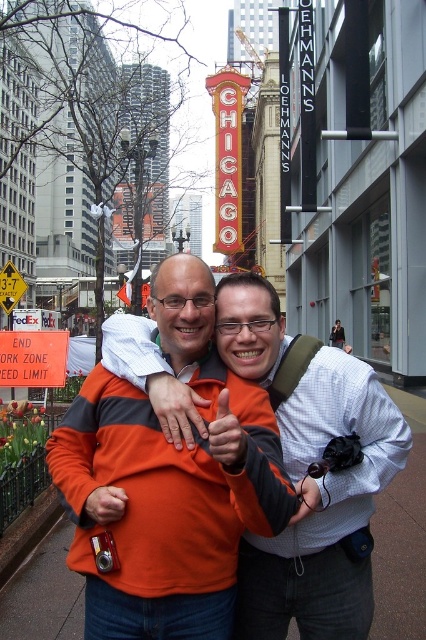
Question: Which object appears farthest from the camera in this image?

Choices:
 (A) yellowmaterial/texturestreet sign at left
 (B) orange plastic sign at lower left

Answer: (A)

Question: Does orange fleece jacket at center appear over yellowmaterial/texturestreet sign at left?

Choices:
 (A) yes
 (B) no

Answer: (B)

Question: Which point is closer to the camera?

Choices:
 (A) orange fleece jacket at center
 (B) orange plastic sign at lower left
 (C) yellowmaterial/texturestreet sign at left

Answer: (A)

Question: Does orange fleece jacket at center appear on the left side of orange plastic sign at lower left?

Choices:
 (A) yes
 (B) no

Answer: (B)

Question: Which point appears closest to the camera in this image?

Choices:
 (A) (258, 552)
 (B) (57, 381)
 (C) (14, 291)

Answer: (A)

Question: Is orange fleece jacket at center wider than yellowmaterial/texturestreet sign at left?

Choices:
 (A) yes
 (B) no

Answer: (A)